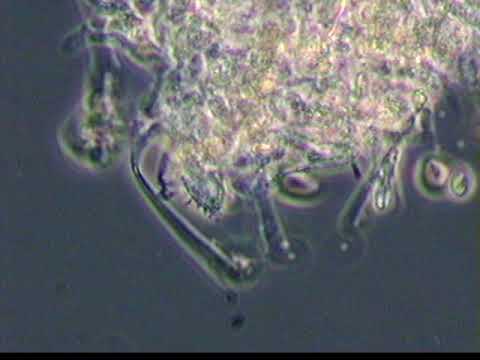
Find the location of a particular element. The width and height of the screenshot is (480, 360). corners is located at coordinates (466, 347), (7, 346), (9, 9), (473, 6).